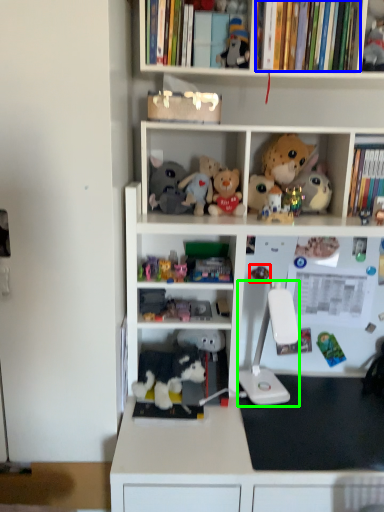
Question: Based on their relative distances, which object is farther from toy (highlighted by a red box)? Choose from book (highlighted by a blue box) and equipment (highlighted by a green box).

Choices:
 (A) book
 (B) equipment

Answer: (A)